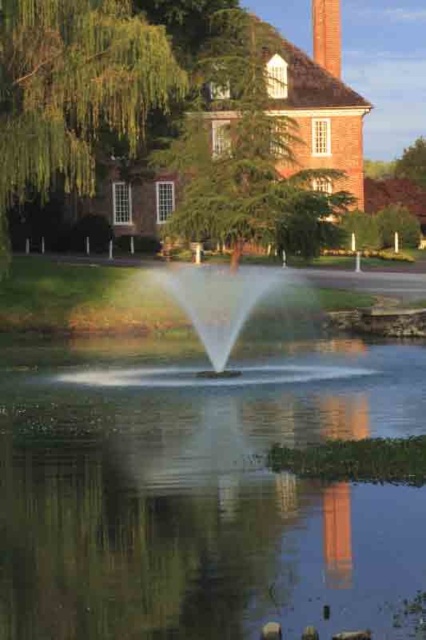
You are an architect analyzing the symmetry of the building in the image. Which object, the green leafy tree at upper center or the red brick chimney at upper center, is positioned lower in the scene?

The green leafy tree at upper center is positioned lower than the red brick chimney at upper center in the scene.

You are standing in front of the large brick building and notice two green leafy trees in the upper part of the scene. Which tree is closer to you, the green leafy tree at upper center or the green leafy tree at upper left?

The green leafy tree at upper center is closer to you because the green leafy tree at upper left is behind it.

You are standing in front of the brick building and want to walk towards the two points marked in the scene. Which point, point (239, 252) or point (316, 38), will you reach first?

Point (239, 252) is closer to the viewer than point (316, 38), so you will reach point (239, 252) first.